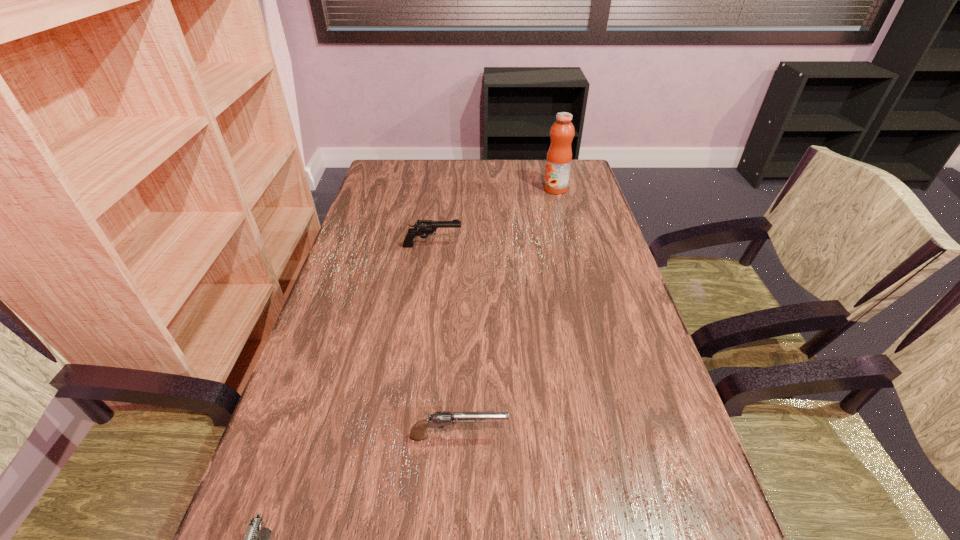
Find the location of a particular element. The height and width of the screenshot is (540, 960). blank region between the second farthest gun and the farthest gun is located at coordinates (445, 341).

The width and height of the screenshot is (960, 540). I want to click on blank region between the second farthest object and the third farthest object, so click(x=445, y=341).

Locate an element on the screen. The width and height of the screenshot is (960, 540). free space between the second farthest object and the fruit juice is located at coordinates (494, 218).

Identify the location of object that stands as the third closest to the farthest gun. This screenshot has height=540, width=960. (256, 539).

This screenshot has width=960, height=540. I want to click on the third closest object to the rightmost object, so tap(256, 539).

Find the location of a particular element. The width and height of the screenshot is (960, 540). gun that is the closest one to the rightmost object is located at coordinates (x=424, y=227).

Locate an element on the screen. This screenshot has height=540, width=960. gun that can be found as the third closest to the rightmost object is located at coordinates (256, 539).